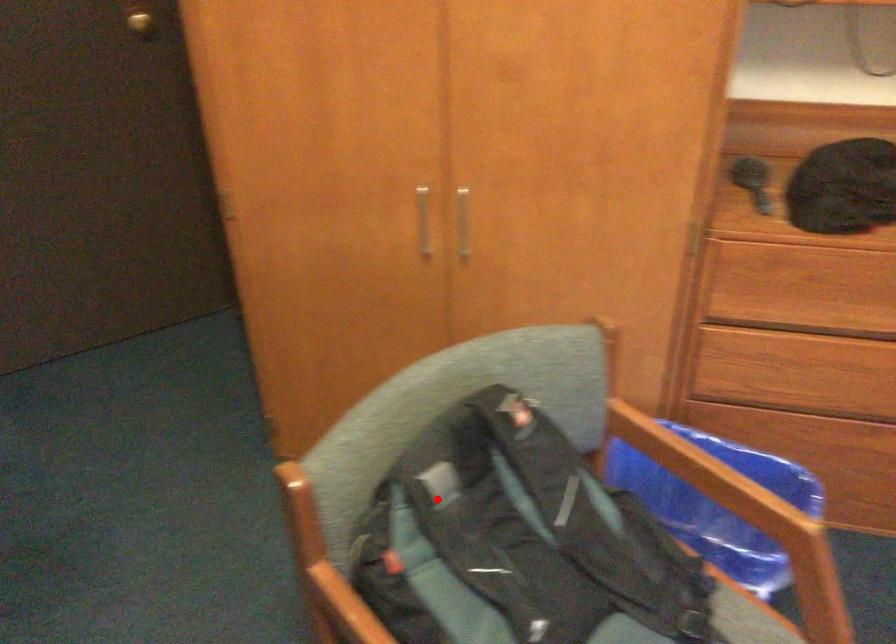
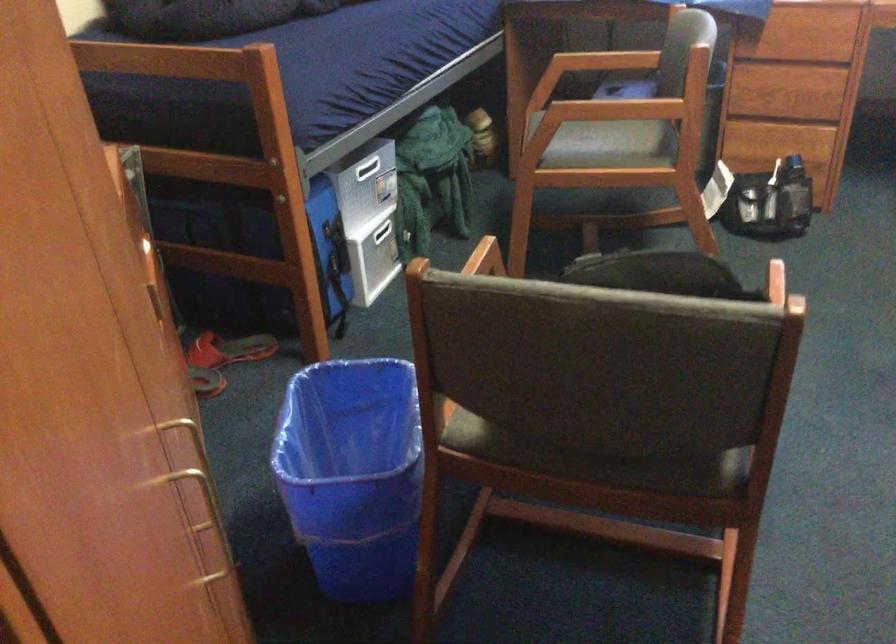
Question: A red point is marked in image1. In image2, is the corresponding 3D point closer to the camera or farther? Reply with the corresponding letter.

Choices:
 (A) The corresponding 3D point is closer.
 (B) The corresponding 3D point is farther.

Answer: (B)